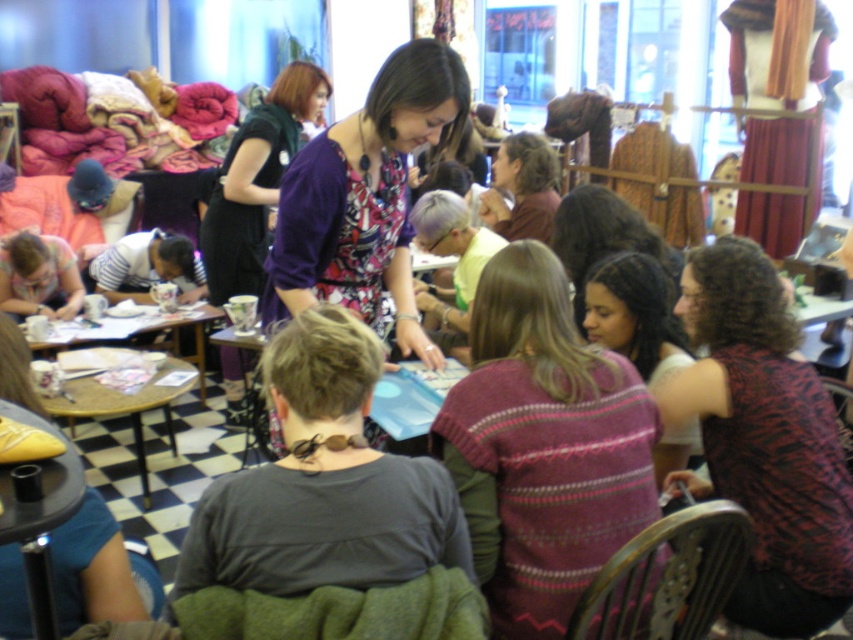
What is the exact coordinate of the dark brown hair at center?

The dark brown hair at center is located at point (604, 237).

You are a participant in the workshop and want to hand your craft to the instructor standing at the dark brown hair at center. You are currently at the wooden table at center. Which direction should you move to reach the instructor?

The dark brown hair at center is to the right of the wooden table at center, so you should move to your right to reach the instructor.